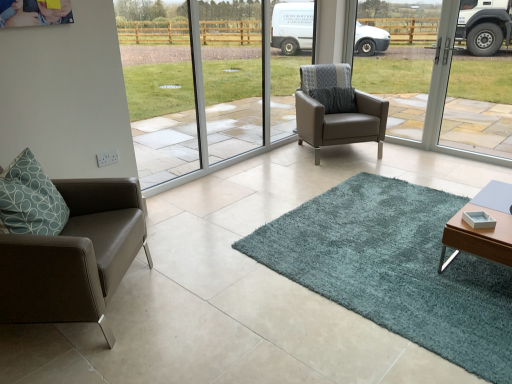
This screenshot has height=384, width=512. I want to click on teal shaggy rug at center, so click(x=395, y=268).

Considering the sizes of objects matte gray leather armchair at center, the second chair in the front-to-back sequence, and wooden table at lower right in the image provided, who is thinner, matte gray leather armchair at center, the second chair in the front-to-back sequence, or wooden table at lower right?

wooden table at lower right.

Looking at this image, which point is more distant from viewer, (333, 125) or (498, 253)?

The point (333, 125) is more distant.

From a real-world perspective, which is physically above, matte gray leather armchair at center, which is the 1th chair in top-to-bottom order, or wooden table at lower right?

matte gray leather armchair at center, which is the 1th chair in top-to-bottom order, from a real-world perspective.

Is transparent glass window at center spatially inside wooden table at lower right, or outside of it?

transparent glass window at center is outside wooden table at lower right.

Would you consider transparent glass window at center to be distant from wooden table at lower right?

transparent glass window at center is far away from wooden table at lower right.

Is transparent glass window at center shorter than wooden table at lower right?

In fact, transparent glass window at center may be taller than wooden table at lower right.

Could you tell me if transparent glass window at center is facing wooden table at lower right?

Yes, transparent glass window at center is facing wooden table at lower right.

In the image, is matte gray leather armchair at center, which ranks as the first chair in right-to-left order, positioned in front of or behind teal shaggy rug at center?

Clearly, matte gray leather armchair at center, which ranks as the first chair in right-to-left order, is behind teal shaggy rug at center.

Between matte gray leather armchair at center, the second chair viewed from the left, and teal shaggy rug at center, which one appears on the left side from the viewer's perspective?

Positioned to the left is matte gray leather armchair at center, the second chair viewed from the left.

Image resolution: width=512 pixels, height=384 pixels. There is a teal shaggy rug at center. Identify the location of the 2nd chair above it (from the image's perspective). (337, 109).

Could you tell me if matte gray leather armchair at center, the second chair viewed from the left, is facing teal shaggy rug at center?

Yes, matte gray leather armchair at center, the second chair viewed from the left, is aimed at teal shaggy rug at center.

From the image's perspective, relative to matte gray leather armchair at center, the second chair in the front-to-back sequence, is transparent glass window at center above or below?

transparent glass window at center is situated higher than matte gray leather armchair at center, the second chair in the front-to-back sequence, in the image.

Between transparent glass window at center and matte gray leather armchair at center, the 2th chair positioned from the bottom, which one has larger width?

Wider between the two is matte gray leather armchair at center, the 2th chair positioned from the bottom.

Considering the relative positions of transparent glass window at center and matte gray leather armchair at center, the 1th chair when ordered from back to front, in the image provided, is transparent glass window at center to the right of matte gray leather armchair at center, the 1th chair when ordered from back to front, from the viewer's perspective?

No, transparent glass window at center is not to the right of matte gray leather armchair at center, the 1th chair when ordered from back to front.

Is point (265, 120) positioned in front of point (350, 73)?

No, (265, 120) is behind (350, 73).

Are matte gray leather armchair at center, the 1th chair when ordered from back to front, and transparent glass window at center making contact?

No, matte gray leather armchair at center, the 1th chair when ordered from back to front, is not touching transparent glass window at center.

Is matte gray leather armchair at center, the second chair in the front-to-back sequence, in front of or behind transparent glass window at center in the image?

matte gray leather armchair at center, the second chair in the front-to-back sequence, is behind transparent glass window at center.

How much distance is there between matte gray leather armchair at center, which is the 1th chair in top-to-bottom order, and transparent glass window at center?

matte gray leather armchair at center, which is the 1th chair in top-to-bottom order, and transparent glass window at center are 32.87 inches apart.

Which of these two, matte gray leather armchair at center, the second chair viewed from the left, or transparent glass window at center, is smaller?

Smaller between the two is transparent glass window at center.

From the image's perspective, which is above, wooden table at lower right or matte gray leather armchair at center, the 1th chair when ordered from back to front?

From the image's view, matte gray leather armchair at center, the 1th chair when ordered from back to front, is above.

Between point (492, 249) and point (367, 126), which one is positioned in front?

Point (492, 249)

Could you tell me if wooden table at lower right is turned towards matte gray leather armchair at center, the second chair viewed from the left?

No, wooden table at lower right is not facing towards matte gray leather armchair at center, the second chair viewed from the left.

From a real-world perspective, which object stands above the other?

In real-world perspective, matte gray leather armchair at center, the second chair in the front-to-back sequence, is above.

Which of these two, wooden table at lower right or transparent glass window at center, is smaller?

With smaller size is wooden table at lower right.

In the image, is wooden table at lower right on the left side or the right side of transparent glass window at center?

wooden table at lower right is to the right of transparent glass window at center.

Which is behind, point (454, 253) or point (160, 188)?

The point (160, 188) is more distant.

Is wooden table at lower right turned away from transparent glass window at center?

No, transparent glass window at center is not at the back of wooden table at lower right.

Image resolution: width=512 pixels, height=384 pixels. What are the coordinates of `table lying on the right of matte gray leather armchair at center, the 1th chair when ordered from back to front` in the screenshot? It's located at (482, 228).

This screenshot has height=384, width=512. In the image, there is a transparent glass window at center. In order to click on table below it (from a real-world perspective) in this screenshot , I will do `click(482, 228)`.

Estimate the real-world distances between objects in this image. Which object is closer to teal shaggy rug at center, wooden table at lower right or matte gray leather armchair at center, the 1th chair when ordered from back to front?

wooden table at lower right is closer to teal shaggy rug at center.

Considering their positions, is wooden table at lower right positioned further to matte brown leather chair at left, placed as the first chair when sorted from bottom to top, than matte gray leather armchair at center, the second chair viewed from the left?

matte gray leather armchair at center, the second chair viewed from the left, is further to matte brown leather chair at left, placed as the first chair when sorted from bottom to top.

Looking at the image, which one is located further to matte brown leather chair at left, placed as the first chair when sorted from bottom to top, transparent glass window at center or wooden table at lower right?

transparent glass window at center is positioned further to the anchor matte brown leather chair at left, placed as the first chair when sorted from bottom to top.

Which object lies further to the anchor point transparent glass window at center, matte brown leather chair at left, the 2th chair when ordered from top to bottom, or teal shaggy rug at center?

The object further to transparent glass window at center is matte brown leather chair at left, the 2th chair when ordered from top to bottom.

When comparing their distances from wooden table at lower right, does matte gray leather armchair at center, which ranks as the first chair in right-to-left order, or matte brown leather chair at left, the 1th chair viewed from the front, seem closer?

matte gray leather armchair at center, which ranks as the first chair in right-to-left order, is closer to wooden table at lower right.

Based on their spatial positions, is teal shaggy rug at center or wooden table at lower right further from matte gray leather armchair at center, which is the 1th chair in top-to-bottom order?

Based on the image, wooden table at lower right appears to be further to matte gray leather armchair at center, which is the 1th chair in top-to-bottom order.

Considering their positions, is matte brown leather chair at left, positioned as the second chair in back-to-front order, positioned closer to teal shaggy rug at center than matte gray leather armchair at center, the second chair viewed from the left?

The object closer to teal shaggy rug at center is matte brown leather chair at left, positioned as the second chair in back-to-front order.

Looking at the image, which one is located further to wooden table at lower right, transparent glass window at center or teal shaggy rug at center?

Among the two, transparent glass window at center is located further to wooden table at lower right.

Image resolution: width=512 pixels, height=384 pixels. In order to click on window screen located between matte brown leather chair at left, the 2th chair when ordered from top to bottom, and wooden table at lower right in the left-right direction in this screenshot , I will do `click(443, 98)`.

The width and height of the screenshot is (512, 384). Identify the location of mat situated between transparent glass window at center and wooden table at lower right from left to right. (395, 268).

Identify the location of window screen located between teal shaggy rug at center and matte gray leather armchair at center, the second chair viewed from the left, in the depth direction. This screenshot has width=512, height=384. (443, 98).

Locate an element on the screen. table located between teal shaggy rug at center and matte gray leather armchair at center, the 2th chair positioned from the bottom, in the depth direction is located at coordinates (482, 228).